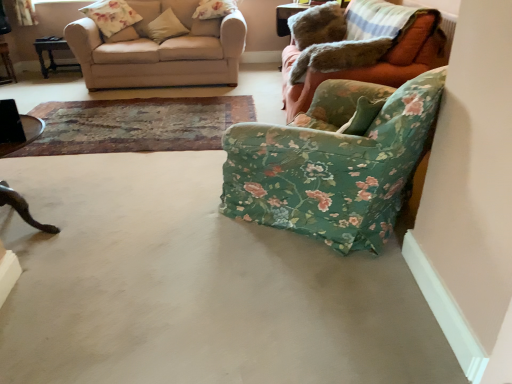
The image size is (512, 384). What do you see at coordinates (22, 208) in the screenshot?
I see `wooden dark brown table at left, which is counted as the 1th table, starting from the front` at bounding box center [22, 208].

At what (x,y) coordinates should I click in order to perform the action: click on floral fabric pillow at upper left, placed as the 4th pillow when sorted from right to left. Please return your answer as a coordinate pair (x, y). Image resolution: width=512 pixels, height=384 pixels. Looking at the image, I should click on (111, 16).

The image size is (512, 384). Find the location of `floral fabric armchair at right, placed as the 2th studio couch when sorted from left to right`. floral fabric armchair at right, placed as the 2th studio couch when sorted from left to right is located at coordinates (370, 66).

The width and height of the screenshot is (512, 384). What do you see at coordinates (51, 53) in the screenshot?
I see `wooden dark brown table at left, the second table viewed from the left` at bounding box center [51, 53].

Where is `wooden dark brown table at left, acting as the 2th table starting from the right`? The width and height of the screenshot is (512, 384). wooden dark brown table at left, acting as the 2th table starting from the right is located at coordinates (51, 53).

What do you see at coordinates (161, 50) in the screenshot? Image resolution: width=512 pixels, height=384 pixels. I see `beige fabric couch at upper left, the 1th studio couch from the left` at bounding box center [161, 50].

Measure the distance between beige fabric couch at upper left, the second studio couch when ordered from right to left, and camera.

They are 4.26 meters apart.

Measure the distance between point (40, 281) and camera.

Point (40, 281) and camera are 6.06 feet apart from each other.

Where is `wooden dark brown table at left, which is the first table in bottom-to-top order`? The height and width of the screenshot is (384, 512). wooden dark brown table at left, which is the first table in bottom-to-top order is located at coordinates (22, 208).

Is fluffy beige pillow at upper left, the 2th pillow in the left-to-right sequence, turned away from floral fabric armchair at right, placed as the 2th studio couch when sorted from left to right?

That's not correct — fluffy beige pillow at upper left, the 2th pillow in the left-to-right sequence, is not looking away from floral fabric armchair at right, placed as the 2th studio couch when sorted from left to right.

From a real-world perspective, does fluffy beige pillow at upper left, which ranks as the third pillow in right-to-left order, sit lower than floral fabric armchair at right, placed as the 2th studio couch when sorted from left to right?

No, from a real-world perspective, fluffy beige pillow at upper left, which ranks as the third pillow in right-to-left order, is not beneath floral fabric armchair at right, placed as the 2th studio couch when sorted from left to right.

Considering the relative sizes of fluffy beige pillow at upper left, which ranks as the third pillow in right-to-left order, and floral fabric armchair at right, placed as the 2th studio couch when sorted from left to right, in the image provided, is fluffy beige pillow at upper left, which ranks as the third pillow in right-to-left order, shorter than floral fabric armchair at right, placed as the 2th studio couch when sorted from left to right,?

Indeed, fluffy beige pillow at upper left, which ranks as the third pillow in right-to-left order, has a lesser height compared to floral fabric armchair at right, placed as the 2th studio couch when sorted from left to right.

Which is more to the right, fluffy beige pillow at upper left, the 2th pillow in the left-to-right sequence, or floral fabric armchair at right, placed as the 2th studio couch when sorted from left to right?

floral fabric armchair at right, placed as the 2th studio couch when sorted from left to right, is more to the right.

Does point (319, 189) appear closer or farther from the camera than point (113, 35)?

Clearly, point (319, 189) is closer to the camera than point (113, 35).

In terms of size, does floral fabric armchair at lower right appear bigger or smaller than fluffy beige pillow at upper left, which ranks as the third pillow in right-to-left order?

In the image, floral fabric armchair at lower right appears to be larger than fluffy beige pillow at upper left, which ranks as the third pillow in right-to-left order.

Considering the positions of objects floral fabric armchair at lower right and fluffy beige pillow at upper left, which ranks as the third pillow in right-to-left order, in the image provided, who is more to the left, floral fabric armchair at lower right or fluffy beige pillow at upper left, which ranks as the third pillow in right-to-left order,?

fluffy beige pillow at upper left, which ranks as the third pillow in right-to-left order, is more to the left.

Which of these two, floral fabric pillow at upper center, which appears as the 1th pillow when viewed from the right, or fluffy beige pillow at upper left, which ranks as the third pillow in right-to-left order, is smaller?

fluffy beige pillow at upper left, which ranks as the third pillow in right-to-left order.

Would you say floral fabric pillow at upper center, which appears as the fourth pillow when viewed from the left, is outside fluffy beige pillow at upper left, the 2th pillow in the left-to-right sequence?

Absolutely, floral fabric pillow at upper center, which appears as the fourth pillow when viewed from the left, is external to fluffy beige pillow at upper left, the 2th pillow in the left-to-right sequence.

Which is more to the left, floral fabric pillow at upper center, which appears as the fourth pillow when viewed from the left, or fluffy beige pillow at upper left, which ranks as the third pillow in right-to-left order?

Positioned to the left is fluffy beige pillow at upper left, which ranks as the third pillow in right-to-left order.

Considering the relative positions of floral fabric pillow at upper left, placed as the 4th pillow when sorted from right to left, and wooden dark brown table at left, the 1th table positioned from the top, in the image provided, is floral fabric pillow at upper left, placed as the 4th pillow when sorted from right to left, to the right of wooden dark brown table at left, the 1th table positioned from the top, from the viewer's perspective?

Correct, you'll find floral fabric pillow at upper left, placed as the 4th pillow when sorted from right to left, to the right of wooden dark brown table at left, the 1th table positioned from the top.

From a real-world perspective, count 3rd tables downward from the floral fabric pillow at upper left, placed as the 4th pillow when sorted from right to left, and point to it. Please provide its 2D coordinates.

[(51, 53)]

Is floral fabric pillow at upper left, arranged as the first pillow when viewed from the left, with wooden dark brown table at left, the 1th table when ordered from back to front?

No, floral fabric pillow at upper left, arranged as the first pillow when viewed from the left, is not beside wooden dark brown table at left, the 1th table when ordered from back to front.

Is floral fabric pillow at upper left, placed as the 4th pillow when sorted from right to left, oriented towards wooden dark brown table at left, marked as the third table in a front-to-back arrangement?

No, floral fabric pillow at upper left, placed as the 4th pillow when sorted from right to left, does not turn towards wooden dark brown table at left, marked as the third table in a front-to-back arrangement.

From the image's perspective, which is below, fluffy beige pillow at upper left, the 2th pillow in the left-to-right sequence, or floral fabric pillow at upper left, placed as the 4th pillow when sorted from right to left?

fluffy beige pillow at upper left, the 2th pillow in the left-to-right sequence.

Is the position of fluffy beige pillow at upper left, which ranks as the third pillow in right-to-left order, more distant than that of floral fabric pillow at upper left, arranged as the first pillow when viewed from the left?

Yes, fluffy beige pillow at upper left, which ranks as the third pillow in right-to-left order, is further from the viewer.

Does fluffy beige pillow at upper left, which ranks as the third pillow in right-to-left order, turn towards floral fabric pillow at upper left, arranged as the first pillow when viewed from the left?

Yes, fluffy beige pillow at upper left, which ranks as the third pillow in right-to-left order, is turned towards floral fabric pillow at upper left, arranged as the first pillow when viewed from the left.

Looking at their sizes, would you say fluffy beige pillow at upper left, which ranks as the third pillow in right-to-left order, is wider or thinner than floral fabric pillow at upper left, placed as the 4th pillow when sorted from right to left?

Clearly, fluffy beige pillow at upper left, which ranks as the third pillow in right-to-left order, has less width compared to floral fabric pillow at upper left, placed as the 4th pillow when sorted from right to left.

Consider the image. Is floral fabric armchair at lower right beside gray concrete floor at lower right?

No.

In the scene shown: Can you confirm if floral fabric armchair at lower right is bigger than gray concrete floor at lower right?

Yes, floral fabric armchair at lower right is bigger than gray concrete floor at lower right.

Considering the relative positions of floral fabric armchair at lower right and gray concrete floor at lower right in the image provided, is floral fabric armchair at lower right behind gray concrete floor at lower right?

No, floral fabric armchair at lower right is closer to the viewer.

This screenshot has width=512, height=384. I want to click on concrete that appears behind the floral fabric armchair at lower right, so click(195, 286).

Can you tell me how much gray concrete floor at lower right and floral fabric armchair at lower right differ in facing direction?

The angle between the facing direction of gray concrete floor at lower right and the facing direction of floral fabric armchair at lower right is 134 degrees.

From a real-world perspective, which is physically above, gray concrete floor at lower right or floral fabric armchair at lower right?

floral fabric armchair at lower right, from a real-world perspective.

Considering their positions, is gray concrete floor at lower right located in front of or behind floral fabric armchair at lower right?

Clearly, gray concrete floor at lower right is behind floral fabric armchair at lower right.

Which pillow is the 4th one when counting from the back of the floral fabric armchair at right, placed as the 2th studio couch when sorted from left to right? Please provide its 2D coordinates.

[(122, 35)]

From the image's perspective, which pillow is the 1st one above the floral fabric armchair at lower right? Please provide its 2D coordinates.

[(122, 35)]

When comparing their distances from beige fabric pillow at upper left, the 2th pillow viewed from the right, does fluffy beige pillow at upper left, which ranks as the third pillow in right-to-left order, or floral fabric armchair at lower right seem further?

floral fabric armchair at lower right is further to beige fabric pillow at upper left, the 2th pillow viewed from the right.

Which object lies nearer to the anchor point beige fabric couch at upper left, the 1th studio couch from the left, brushed metal table at left, marked as the second table in a front-to-back arrangement, or floral fabric armchair at lower right?

The object closer to beige fabric couch at upper left, the 1th studio couch from the left, is brushed metal table at left, marked as the second table in a front-to-back arrangement.

Looking at the image, which one is located further to fluffy beige pillow at upper left, which ranks as the third pillow in right-to-left order, floral fabric armchair at right, which appears as the 1th studio couch when viewed from the right, or beige fabric couch at upper left, the second studio couch when ordered from right to left?

floral fabric armchair at right, which appears as the 1th studio couch when viewed from the right, lies further to fluffy beige pillow at upper left, which ranks as the third pillow in right-to-left order, than the other object.

When comparing their distances from floral fabric armchair at lower right, does wooden dark brown table at left, marked as the third table in a front-to-back arrangement, or wooden dark brown table at left, the third table viewed from the left, seem further?

Among the two, wooden dark brown table at left, marked as the third table in a front-to-back arrangement, is located further to floral fabric armchair at lower right.

Based on their spatial positions, is floral fabric armchair at lower right or wooden dark brown table at left, which is the first table in bottom-to-top order, further from brushed metal table at left, the second table positioned from the top?

Based on the image, floral fabric armchair at lower right appears to be further to brushed metal table at left, the second table positioned from the top.

Which object lies further to the anchor point brushed metal table at left, marked as the second table in a front-to-back arrangement, floral fabric pillow at upper center, which appears as the 1th pillow when viewed from the right, or beige fabric pillow at upper left, the 2th pillow viewed from the right?

The object further to brushed metal table at left, marked as the second table in a front-to-back arrangement, is floral fabric pillow at upper center, which appears as the 1th pillow when viewed from the right.

From the image, which object appears to be farther from floral fabric armchair at lower right, floral fabric pillow at upper left, arranged as the first pillow when viewed from the left, or wooden dark brown table at left, which is the first table in bottom-to-top order?

floral fabric pillow at upper left, arranged as the first pillow when viewed from the left.

Based on their spatial positions, is brushed metal table at left, which appears as the third table when viewed from the right, or floral fabric armchair at right, placed as the 2th studio couch when sorted from left to right, closer to floral fabric armchair at lower right?

floral fabric armchair at right, placed as the 2th studio couch when sorted from left to right, is closer to floral fabric armchair at lower right.

You are a GUI agent. You are given a task and a screenshot of the screen. Output one action in this format:
    pyautogui.click(x=<x>, y=<y>)
    Task: Click on the chair between floral fabric armchair at right, placed as the 2th studio couch when sorted from left to right, and gray concrete floor at lower right vertically
    This screenshot has width=512, height=384.
    Given the screenshot: What is the action you would take?
    pyautogui.click(x=330, y=170)

Where is `studio couch located between wooden dark brown table at left, the 1th table positioned from the top, and floral fabric pillow at upper center, which appears as the fourth pillow when viewed from the left, in the left-right direction`? studio couch located between wooden dark brown table at left, the 1th table positioned from the top, and floral fabric pillow at upper center, which appears as the fourth pillow when viewed from the left, in the left-right direction is located at coordinates (161, 50).

You are a GUI agent. You are given a task and a screenshot of the screen. Output one action in this format:
    pyautogui.click(x=<x>, y=<y>)
    Task: Click on the studio couch between wooden dark brown table at left, the second table viewed from the left, and floral fabric armchair at right, which appears as the 1th studio couch when viewed from the right, in the horizontal direction
    
    Given the screenshot: What is the action you would take?
    pyautogui.click(x=161, y=50)

Find the location of `concrete between floral fabric armchair at lower right and floral fabric pillow at upper left, placed as the 4th pillow when sorted from right to left, along the z-axis`. concrete between floral fabric armchair at lower right and floral fabric pillow at upper left, placed as the 4th pillow when sorted from right to left, along the z-axis is located at coordinates (195, 286).